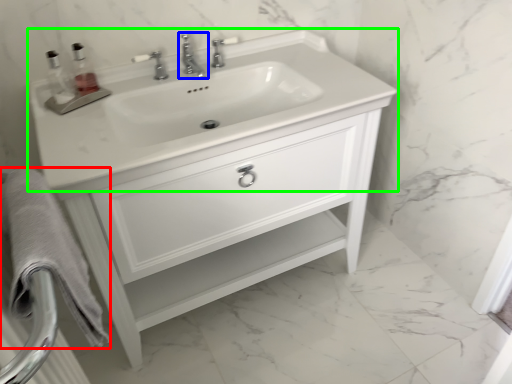
Question: Which object is the closest to the bath towel (highlighted by a red box)? Choose among these: tap (highlighted by a blue box) or sink (highlighted by a green box).

Choices:
 (A) tap
 (B) sink

Answer: (B)